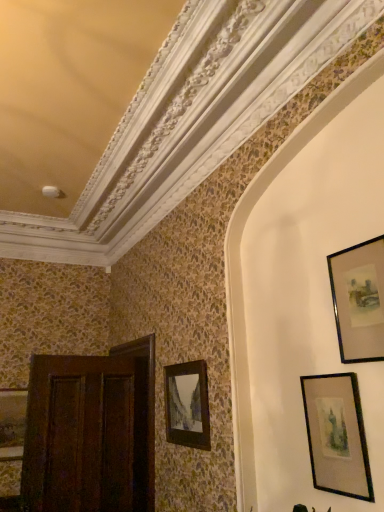
This screenshot has width=384, height=512. What do you see at coordinates (87, 435) in the screenshot? I see `dark wood door at left` at bounding box center [87, 435].

What do you see at coordinates (337, 435) in the screenshot? I see `black matte picture frame at lower right, the 2th picture frame in the top-to-bottom sequence` at bounding box center [337, 435].

The width and height of the screenshot is (384, 512). Describe the element at coordinates (187, 405) in the screenshot. I see `wooden picture frame at center, which is counted as the 3th picture frame, starting from the top` at that location.

I want to click on black glossy picture frame at upper right, arranged as the 4th picture frame when viewed from the left, so click(x=359, y=300).

Find the location of a particular element. Image resolution: width=384 pixels, height=512 pixels. dark wood door at left is located at coordinates (87, 435).

Does black matte picture frame at lower right, the second picture frame from the front, have a smaller size compared to dark wood door at left?

Yes.

Is black matte picture frame at lower right, acting as the third picture frame starting from the bottom, at the left side of dark wood door at left?

Incorrect, black matte picture frame at lower right, acting as the third picture frame starting from the bottom, is not on the left side of dark wood door at left.

Does black matte picture frame at lower right, the second picture frame from the front, touch dark wood door at left?

No, black matte picture frame at lower right, the second picture frame from the front, is not with dark wood door at left.

From the image's perspective, does wooden picture frame at center, placed as the 2th picture frame when sorted from back to front, appear lower than black matte picture frame at lower right, the 2th picture frame in the top-to-bottom sequence?

Correct, wooden picture frame at center, placed as the 2th picture frame when sorted from back to front, appears lower than black matte picture frame at lower right, the 2th picture frame in the top-to-bottom sequence, in the image.

Image resolution: width=384 pixels, height=512 pixels. In order to click on the 1st picture frame to the right of the wooden picture frame at center, which is counted as the 3th picture frame, starting from the front, counting from the anchor's position in this screenshot , I will do `click(337, 435)`.

Is wooden picture frame at center, the 2th picture frame positioned from the left, wider or thinner than black matte picture frame at lower right, placed as the third picture frame when sorted from left to right?

Considering their sizes, wooden picture frame at center, the 2th picture frame positioned from the left, looks broader than black matte picture frame at lower right, placed as the third picture frame when sorted from left to right.

In the scene shown: Is wooden picture frame at center, which is counted as the 3th picture frame, starting from the top, bigger than black matte picture frame at lower right, the second picture frame from the front?

Correct, wooden picture frame at center, which is counted as the 3th picture frame, starting from the top, is larger in size than black matte picture frame at lower right, the second picture frame from the front.

What's the angular difference between matte black picture frame at left, acting as the 1th picture frame starting from the back, and wooden picture frame at center, placed as the 2th picture frame when sorted from back to front,'s facing directions?

The angular difference between matte black picture frame at left, acting as the 1th picture frame starting from the back, and wooden picture frame at center, placed as the 2th picture frame when sorted from back to front, is 89.3 degrees.

Considering the positions of points (20, 447) and (208, 445), is point (20, 447) farther from camera compared to point (208, 445)?

Yes.

Measure the distance between matte black picture frame at left, the fourth picture frame when ordered from front to back, and wooden picture frame at center, which is counted as the 3th picture frame, starting from the front.

The distance of matte black picture frame at left, the fourth picture frame when ordered from front to back, from wooden picture frame at center, which is counted as the 3th picture frame, starting from the front, is 1.75 meters.

Image resolution: width=384 pixels, height=512 pixels. Identify the location of the 1st picture frame above when counting from the matte black picture frame at left, the 4th picture frame when ordered from right to left (from the image's perspective). (187, 405).

Considering the relative positions of dark wood door at left and black matte picture frame at lower right, the 2th picture frame in the top-to-bottom sequence, in the image provided, is dark wood door at left to the left or to the right of black matte picture frame at lower right, the 2th picture frame in the top-to-bottom sequence,?

dark wood door at left is positioned on black matte picture frame at lower right, the 2th picture frame in the top-to-bottom sequence,'s left side.

Is dark wood door at left bigger than black matte picture frame at lower right, the 2th picture frame in the top-to-bottom sequence?

Correct, dark wood door at left is larger in size than black matte picture frame at lower right, the 2th picture frame in the top-to-bottom sequence.

From the image's perspective, who appears lower, dark wood door at left or black matte picture frame at lower right, acting as the third picture frame starting from the bottom?

dark wood door at left is shown below in the image.

From a real-world perspective, which object stands above the other?

black matte picture frame at lower right, the 3th picture frame positioned from the back, from a real-world perspective.

From the image's perspective, which one is positioned lower, black matte picture frame at lower right, the 2th picture frame from the right, or wooden picture frame at center, the 2th picture frame positioned from the left?

wooden picture frame at center, the 2th picture frame positioned from the left, is shown below in the image.

Considering their positions, is black matte picture frame at lower right, the 2th picture frame in the top-to-bottom sequence, located in front of or behind wooden picture frame at center, placed as the 2th picture frame when sorted from back to front?

Clearly, black matte picture frame at lower right, the 2th picture frame in the top-to-bottom sequence, is in front of wooden picture frame at center, placed as the 2th picture frame when sorted from back to front.

Which is more to the left, black matte picture frame at lower right, the 3th picture frame positioned from the back, or wooden picture frame at center, the 2th picture frame from the bottom?

From the viewer's perspective, wooden picture frame at center, the 2th picture frame from the bottom, appears more on the left side.

Is black matte picture frame at lower right, the 3th picture frame positioned from the back, not close to wooden picture frame at center, the 2th picture frame positioned from the left?

No, black matte picture frame at lower right, the 3th picture frame positioned from the back, is not far from wooden picture frame at center, the 2th picture frame positioned from the left.

Is wooden picture frame at center, which is counted as the 3th picture frame, starting from the top, to the left or to the right of black glossy picture frame at upper right, the 1th picture frame positioned from the right, in the image?

From the image, it's evident that wooden picture frame at center, which is counted as the 3th picture frame, starting from the top, is to the left of black glossy picture frame at upper right, the 1th picture frame positioned from the right.

From a real-world perspective, between wooden picture frame at center, the 2th picture frame positioned from the left, and black glossy picture frame at upper right, the 1th picture frame when ordered from top to bottom, who is vertically lower?

From a 3D spatial view, wooden picture frame at center, the 2th picture frame positioned from the left, is below.

Considering the sizes of objects wooden picture frame at center, placed as the 2th picture frame when sorted from back to front, and black glossy picture frame at upper right, the 1th picture frame when ordered from top to bottom, in the image provided, who is shorter, wooden picture frame at center, placed as the 2th picture frame when sorted from back to front, or black glossy picture frame at upper right, the 1th picture frame when ordered from top to bottom,?

Standing shorter between the two is black glossy picture frame at upper right, the 1th picture frame when ordered from top to bottom.

From the image's perspective, is wooden picture frame at center, the 2th picture frame from the bottom, above black glossy picture frame at upper right, the 1th picture frame positioned from the right?

Actually, wooden picture frame at center, the 2th picture frame from the bottom, appears below black glossy picture frame at upper right, the 1th picture frame positioned from the right, in the image.

Which is closer to the camera, (150, 445) or (25, 399)?

Clearly, point (150, 445) is closer to the camera than point (25, 399).

You are a GUI agent. You are given a task and a screenshot of the screen. Output one action in this format:
    pyautogui.click(x=<x>, y=<y>)
    Task: Click on the door located underneath the matte black picture frame at left, the 4th picture frame when ordered from right to left (from a real-world perspective)
    
    Given the screenshot: What is the action you would take?
    pyautogui.click(x=87, y=435)

Can you tell me how much dark wood door at left and matte black picture frame at left, the 1th picture frame in the bottom-to-top sequence, differ in facing direction?

They differ by 167 degrees in their facing directions.

Between dark wood door at left and matte black picture frame at left, which is the 1th picture frame from left to right, which one appears on the right side from the viewer's perspective?

Positioned to the right is dark wood door at left.

Locate an element on the screen. The image size is (384, 512). door below the black matte picture frame at lower right, the 2th picture frame from the right (from a real-world perspective) is located at coordinates 87,435.

From the wooden picture frame at center, the 2th picture frame from the bottom, count 1st picture frame to the right and point to it. Please provide its 2D coordinates.

[(337, 435)]

Based on the photo, when comparing their distances from black glossy picture frame at upper right, the first picture frame in the front-to-back sequence, does dark wood door at left or wooden picture frame at center, which is counted as the 3th picture frame, starting from the front, seem further?

Based on the image, dark wood door at left appears to be further to black glossy picture frame at upper right, the first picture frame in the front-to-back sequence.

When comparing their distances from wooden picture frame at center, placed as the 2th picture frame when sorted from back to front, does matte black picture frame at left, marked as the fourth picture frame in a top-to-bottom arrangement, or dark wood door at left seem closer?

Based on the image, dark wood door at left appears to be nearer to wooden picture frame at center, placed as the 2th picture frame when sorted from back to front.

Considering their positions, is black matte picture frame at lower right, the 2th picture frame from the right, positioned closer to matte black picture frame at left, the fourth picture frame when ordered from front to back, than black glossy picture frame at upper right, arranged as the 4th picture frame when viewed from the left?

black matte picture frame at lower right, the 2th picture frame from the right, lies closer to matte black picture frame at left, the fourth picture frame when ordered from front to back, than the other object.

When comparing their distances from wooden picture frame at center, the 2th picture frame from the bottom, does dark wood door at left or matte black picture frame at left, the fourth picture frame when ordered from front to back, seem closer?

dark wood door at left is positioned closer to the anchor wooden picture frame at center, the 2th picture frame from the bottom.

Considering their positions, is wooden picture frame at center, which is counted as the 3th picture frame, starting from the front, positioned further to dark wood door at left than black matte picture frame at lower right, placed as the third picture frame when sorted from left to right?

black matte picture frame at lower right, placed as the third picture frame when sorted from left to right, lies further to dark wood door at left than the other object.

Estimate the real-world distances between objects in this image. Which object is closer to dark wood door at left, black glossy picture frame at upper right, arranged as the 4th picture frame when viewed from the left, or wooden picture frame at center, placed as the 2th picture frame when sorted from back to front?

The object closer to dark wood door at left is wooden picture frame at center, placed as the 2th picture frame when sorted from back to front.

Estimate the real-world distances between objects in this image. Which object is closer to wooden picture frame at center, the 2th picture frame positioned from the left, black matte picture frame at lower right, the 3th picture frame positioned from the back, or black glossy picture frame at upper right, the 1th picture frame positioned from the right?

The object closer to wooden picture frame at center, the 2th picture frame positioned from the left, is black matte picture frame at lower right, the 3th picture frame positioned from the back.

Looking at this image, which object lies further to the anchor point matte black picture frame at left, marked as the fourth picture frame in a top-to-bottom arrangement, wooden picture frame at center, which is counted as the 3th picture frame, starting from the right, or dark wood door at left?

The object further to matte black picture frame at left, marked as the fourth picture frame in a top-to-bottom arrangement, is wooden picture frame at center, which is counted as the 3th picture frame, starting from the right.

Find the location of `door located between matte black picture frame at left, the 1th picture frame in the bottom-to-top sequence, and wooden picture frame at center, placed as the 2th picture frame when sorted from back to front, in the left-right direction`. door located between matte black picture frame at left, the 1th picture frame in the bottom-to-top sequence, and wooden picture frame at center, placed as the 2th picture frame when sorted from back to front, in the left-right direction is located at coordinates pyautogui.click(x=87, y=435).

What are the coordinates of `picture frame between matte black picture frame at left, which is the 1th picture frame from left to right, and black matte picture frame at lower right, placed as the third picture frame when sorted from left to right, in the horizontal direction` in the screenshot? It's located at (187, 405).

Where is `picture frame located between black glossy picture frame at upper right, marked as the 4th picture frame in a bottom-to-top arrangement, and wooden picture frame at center, the 2th picture frame from the bottom, in the depth direction`? The image size is (384, 512). picture frame located between black glossy picture frame at upper right, marked as the 4th picture frame in a bottom-to-top arrangement, and wooden picture frame at center, the 2th picture frame from the bottom, in the depth direction is located at coordinates (337, 435).

What are the coordinates of `door between matte black picture frame at left, acting as the 1th picture frame starting from the back, and black glossy picture frame at upper right, the 4th picture frame viewed from the back, from left to right` in the screenshot? It's located at (87, 435).